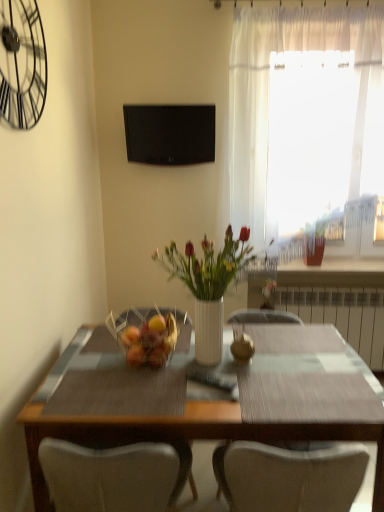
Image resolution: width=384 pixels, height=512 pixels. I want to click on free point in front of translucent glass basket at center, so [x=142, y=391].